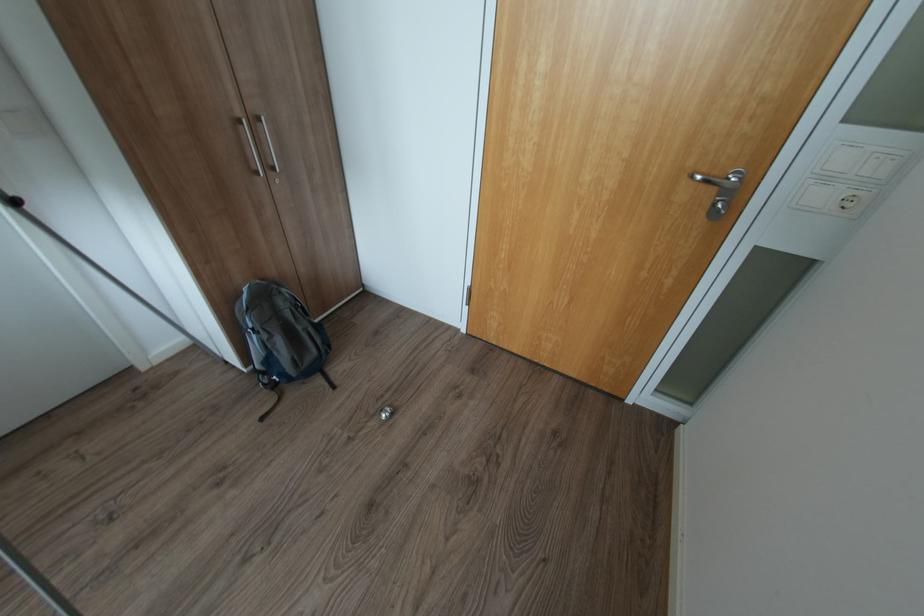
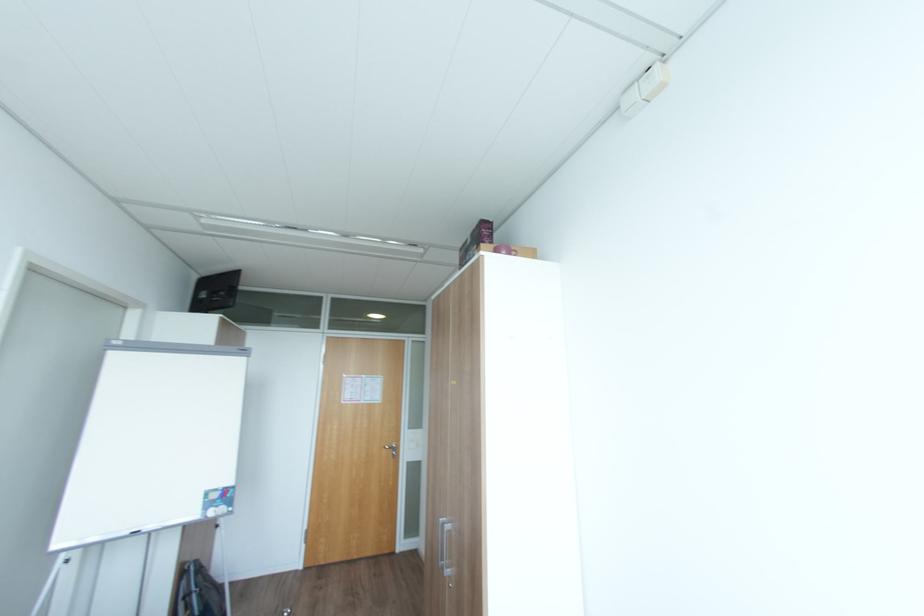
Where in the second image is the point corresponding to point 703,177 from the first image?

(392, 448)